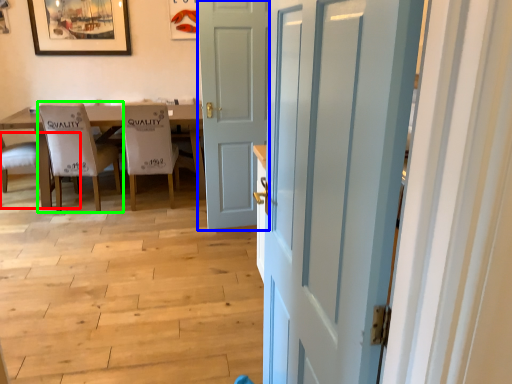
Question: Which object is the closest to the chair (highlighted by a red box)? Choose among these: door (highlighted by a blue box) or chair (highlighted by a green box).

Choices:
 (A) door
 (B) chair

Answer: (B)